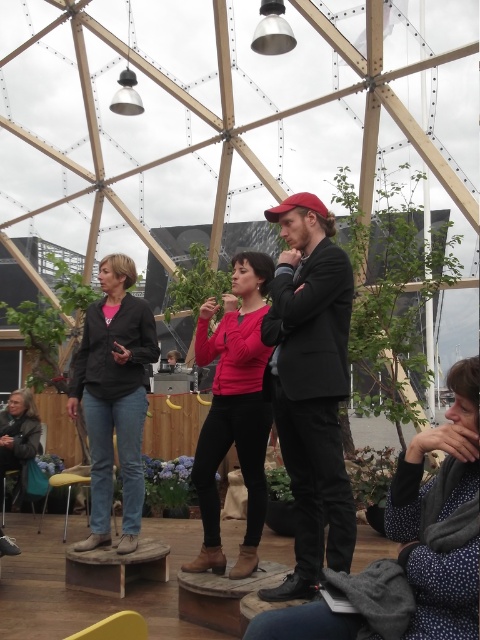
In the scene shown: You are standing at the entrance of the geodesic dome and want to locate the denim jacket at center. According to the coordinates provided, where should you look?

The denim jacket at center is located at coordinates point [113,397].

You are a photographer standing at the entrance of the geodesic dome. You need to capture a photo of the matte black suit at center and the yellow plastic stool at lower center. Which object is taller?

The matte black suit at center is much taller than the yellow plastic stool at lower center.